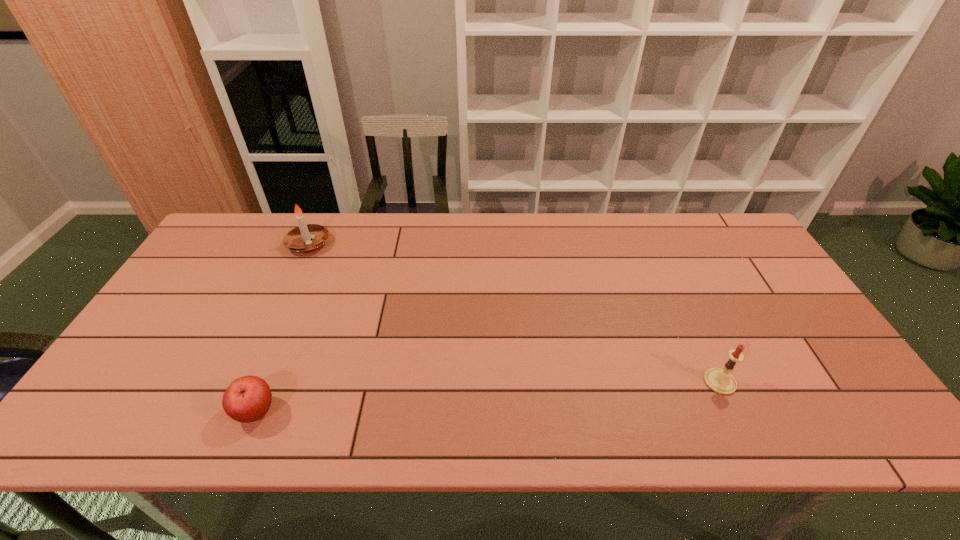
Where is `the left candle`? Image resolution: width=960 pixels, height=540 pixels. the left candle is located at coordinates (307, 238).

I want to click on the farthest object, so click(x=307, y=238).

At what (x,y) coordinates should I click in order to perform the action: click on the rightmost object. Please return your answer as a coordinate pair (x, y). Looking at the image, I should click on (719, 380).

Locate an element on the screen. the right candle is located at coordinates (719, 380).

Where is `the shortest object`? The image size is (960, 540). the shortest object is located at coordinates (247, 399).

The height and width of the screenshot is (540, 960). Identify the location of vacant space located 0.400m on the front of the farthest object. (x=254, y=363).

The image size is (960, 540). In order to click on free space located 0.060m on the front of the nearer candle in this screenshot , I will do `click(737, 419)`.

Identify the location of free space located on the right of the apple. The height and width of the screenshot is (540, 960). (322, 411).

This screenshot has width=960, height=540. What are the coordinates of `object at the far edge` in the screenshot? It's located at point(307,238).

Locate an element on the screen. object that is at the near edge is located at coordinates (247, 399).